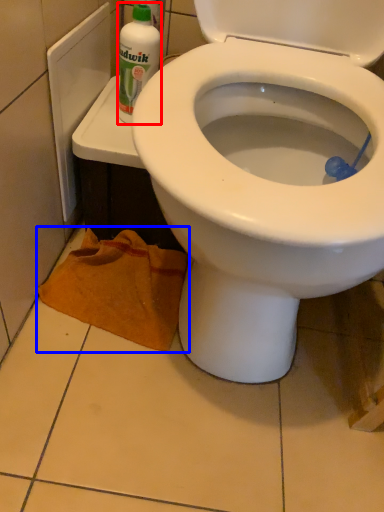
Question: Among these objects, which one is farthest to the camera, cleaning product (highlighted by a red box) or material (highlighted by a blue box)?

Choices:
 (A) cleaning product
 (B) material

Answer: (B)